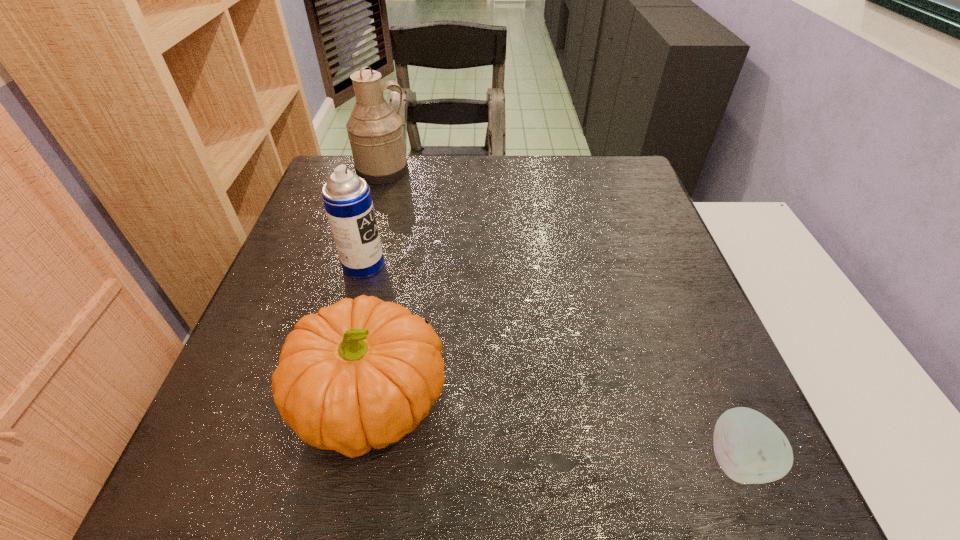
This screenshot has width=960, height=540. I want to click on pumpkin that is positioned at the near edge, so click(x=363, y=373).

Identify the location of apple situated at the near edge. The image size is (960, 540). (750, 449).

You are a GUI agent. You are given a task and a screenshot of the screen. Output one action in this format:
    pyautogui.click(x=<x>, y=<y>)
    Task: Click on the pitcher present at the left edge
    
    Given the screenshot: What is the action you would take?
    pyautogui.click(x=375, y=132)

Image resolution: width=960 pixels, height=540 pixels. Identify the location of aerosol can positioned at the left edge. (347, 199).

The height and width of the screenshot is (540, 960). I want to click on pumpkin present at the left edge, so click(363, 373).

Identify the location of object that is at the right edge. The image size is (960, 540). (750, 449).

You are a GUI agent. You are given a task and a screenshot of the screen. Output one action in this format:
    pyautogui.click(x=<x>, y=<y>)
    Task: Click on the object that is at the far left corner
    Image resolution: width=960 pixels, height=540 pixels.
    Given the screenshot: What is the action you would take?
    pyautogui.click(x=375, y=132)

Locate an element on the screen. The width and height of the screenshot is (960, 540). object that is at the near left corner is located at coordinates (363, 373).

The width and height of the screenshot is (960, 540). I want to click on object located in the near right corner section of the desktop, so click(x=750, y=449).

At what (x,y) coordinates should I click in order to perform the action: click on free space at the far edge of the desktop. Please return your answer as a coordinate pair (x, y). Looking at the image, I should click on [x=424, y=171].